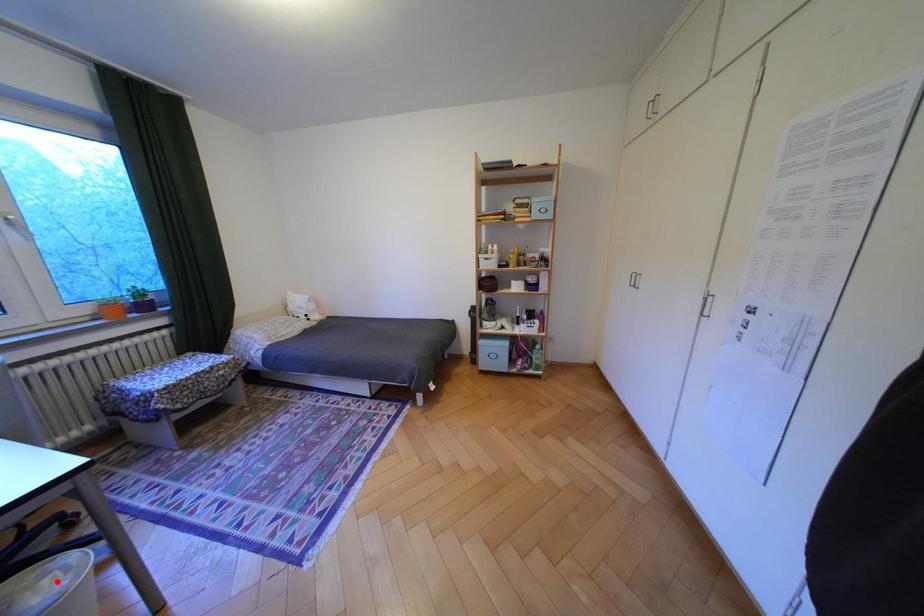
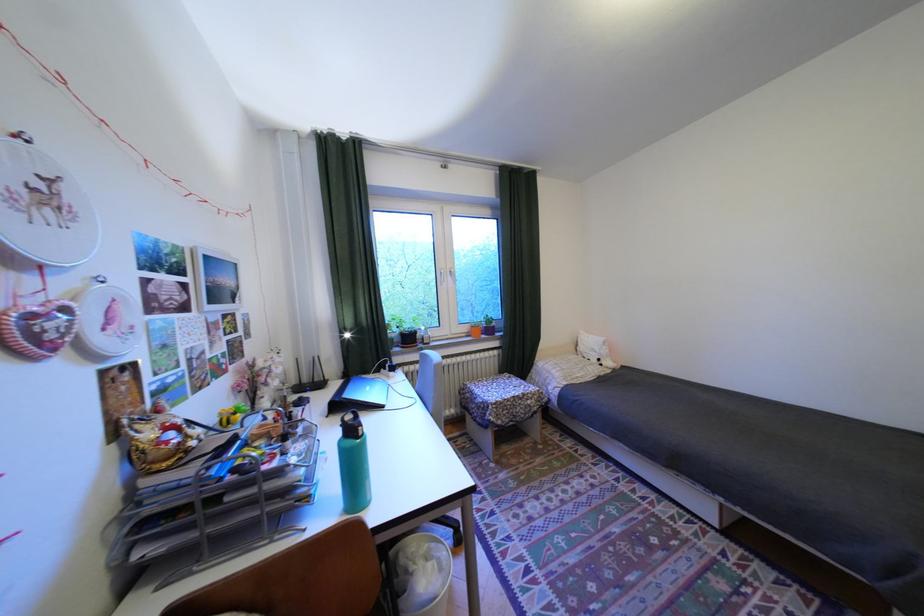
In the second image, find the point that corresponds to the highlighted location in the first image.

(442, 565)